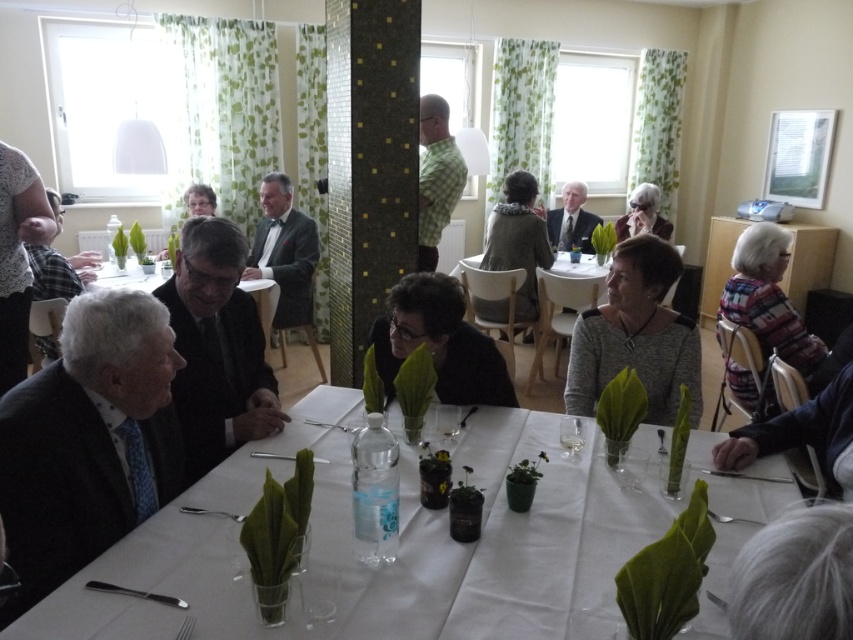
Question: From the image, what is the correct spatial relationship of gray hair at lower right in relation to plaid fabric shirt at left?

Choices:
 (A) below
 (B) above

Answer: (A)

Question: Which point is farther to the camera?

Choices:
 (A) green checkered shirt at center
 (B) blue fabric jacket at lower right

Answer: (A)

Question: Estimate the real-world distances between objects in this image. Which object is farther from the plaid wool sweater at right?

Choices:
 (A) black matte glasses at center
 (B) green textured sweater at center
 (C) clear glass wine glass at center
 (D) white cloth table at lower center

Answer: (B)

Question: Which is farther from the blue fabric jacket at lower right?

Choices:
 (A) gray hair at lower right
 (B) green textured sweater at center
 (C) matte black suit at center

Answer: (C)

Question: Where is gray sweater at center located in relation to black matte glasses at center in the image?

Choices:
 (A) below
 (B) above

Answer: (B)

Question: Is black matte glasses at center positioned before matte black suit at center?

Choices:
 (A) no
 (B) yes

Answer: (B)